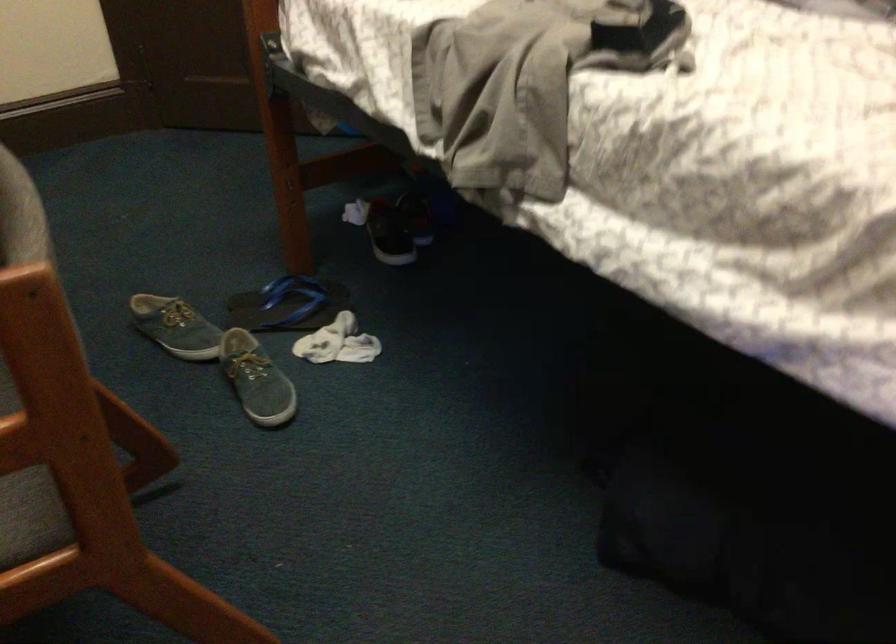
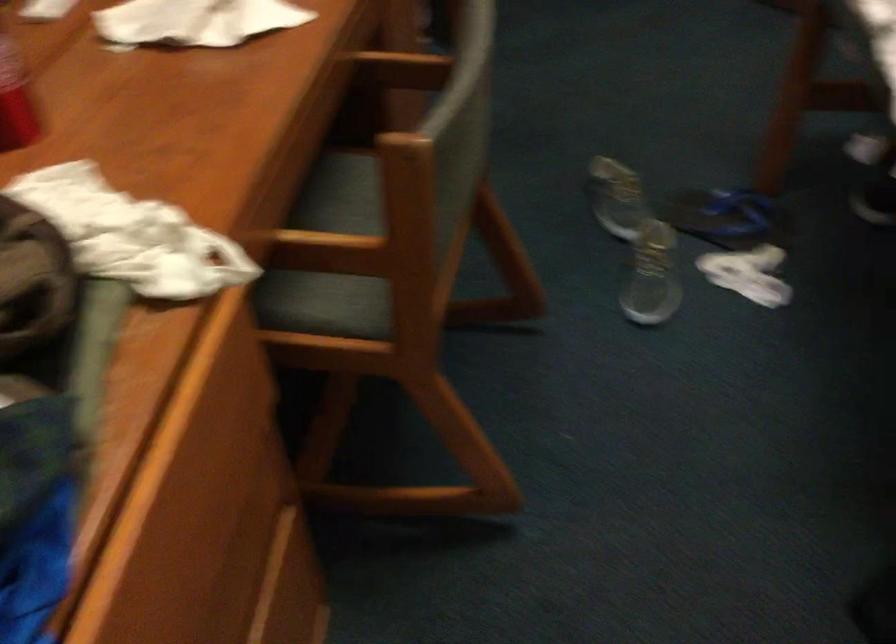
Where in the second image is the point corresponding to (178,327) from the first image?

(616, 198)